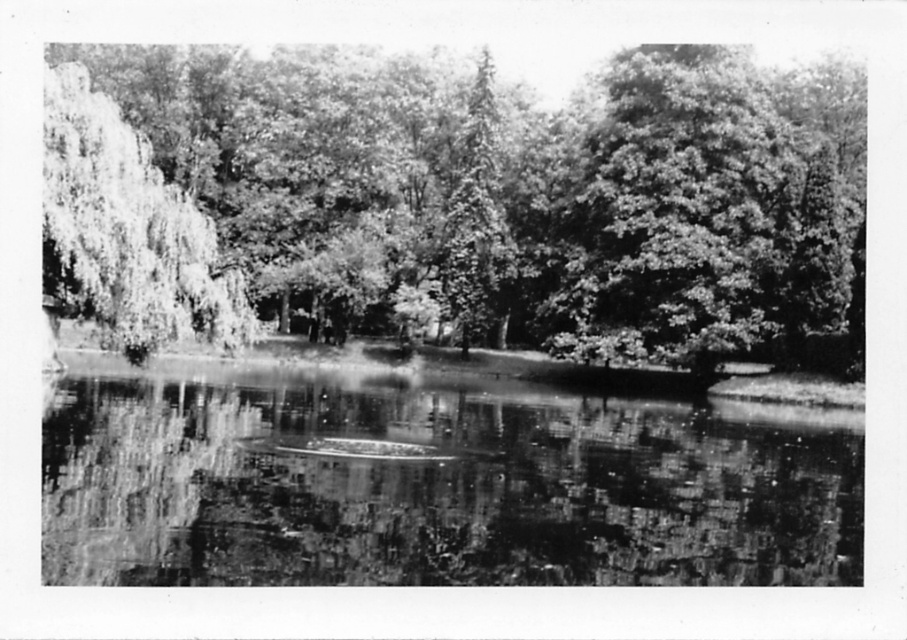
You are standing at the edge of the water and want to take a photo of both the smooth reflective water at center and the grayscale leafy tree at left. Which object should you position closer to the left side of your camera frame?

The grayscale leafy tree at left is already positioned on the left side, so you should position it closer to the left side of your camera frame.

You are an artist trying to paint this scene. You need to decide which area to focus on first based on their sizes. Which object should you paint first, the smooth reflective water at center or the grayscale leafy tree at left?

The smooth reflective water at center has a smaller size compared to the grayscale leafy tree at left, so you should paint the grayscale leafy tree at left first since it is larger and might form the foundation of the composition.